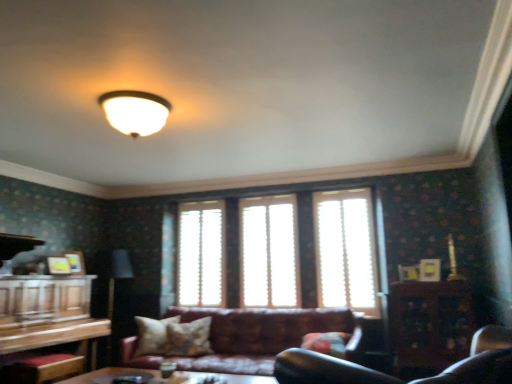
Question: Is translucent wood blinds at center, placed as the second window when sorted from right to left, thinner than white wood blinds at center, which ranks as the 1th window in right-to-left order?

Choices:
 (A) no
 (B) yes

Answer: (A)

Question: Can you see translucent wood blinds at center, the 2th window in the left-to-right sequence, touching white wood blinds at center, which ranks as the 1th window in right-to-left order?

Choices:
 (A) no
 (B) yes

Answer: (A)

Question: Can white wood blinds at center, which ranks as the 1th window in right-to-left order, be found inside translucent wood blinds at center, the 2th window in the left-to-right sequence?

Choices:
 (A) no
 (B) yes

Answer: (A)

Question: Considering the relative sizes of translucent wood blinds at center, placed as the second window when sorted from right to left, and white wood blinds at center, which ranks as the 1th window in right-to-left order, in the image provided, is translucent wood blinds at center, placed as the second window when sorted from right to left, smaller than white wood blinds at center, which ranks as the 1th window in right-to-left order,?

Choices:
 (A) no
 (B) yes

Answer: (A)

Question: From a real-world perspective, is translucent wood blinds at center, the 2th window in the left-to-right sequence, physically above white wood blinds at center, the 3th window positioned from the left?

Choices:
 (A) yes
 (B) no

Answer: (A)

Question: From the image's perspective, does translucent wood blinds at center, the 2th window in the left-to-right sequence, appear lower than white wood blinds at center, the 3th window positioned from the left?

Choices:
 (A) no
 (B) yes

Answer: (B)

Question: Are leather couch at center and matte white ceiling light at upper center far apart?

Choices:
 (A) yes
 (B) no

Answer: (A)

Question: Is leather couch at center further to camera compared to matte white ceiling light at upper center?

Choices:
 (A) no
 (B) yes

Answer: (B)

Question: Does leather couch at center appear on the right side of matte white ceiling light at upper center?

Choices:
 (A) yes
 (B) no

Answer: (A)

Question: From a real-world perspective, is leather couch at center physically below matte white ceiling light at upper center?

Choices:
 (A) yes
 (B) no

Answer: (A)

Question: Can you confirm if leather couch at center is shorter than matte white ceiling light at upper center?

Choices:
 (A) no
 (B) yes

Answer: (A)

Question: Can you confirm if leather couch at center is positioned to the left of matte white ceiling light at upper center?

Choices:
 (A) yes
 (B) no

Answer: (B)

Question: Would you say matte white ceiling light at upper center is part of translucent wood blinds at center, placed as the second window when sorted from right to left,'s contents?

Choices:
 (A) yes
 (B) no

Answer: (B)